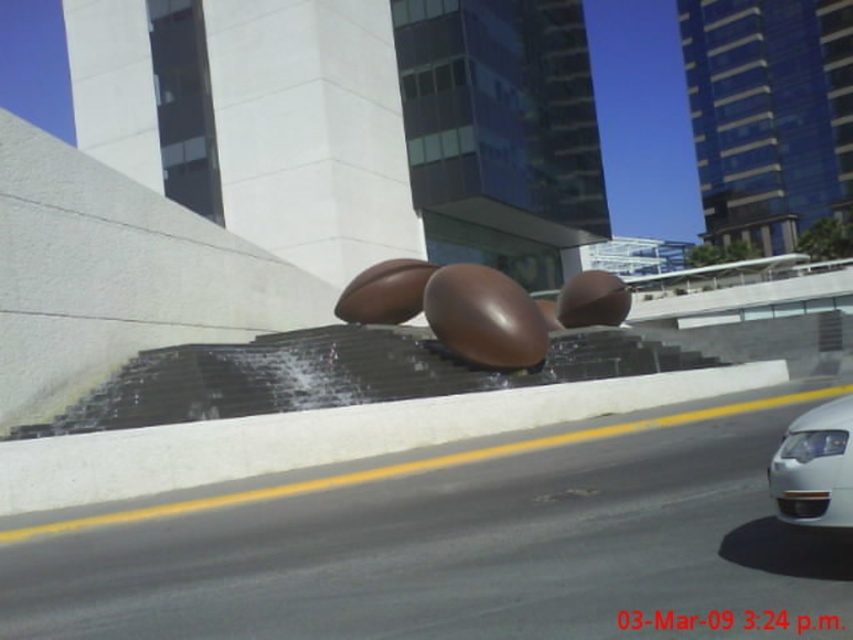
You are a photographer standing at the edge of the paved road. You want to capture a photo that includes both the shiny brown eggs at center and the white glossy car at right. Based on their sizes, which object should you focus on first to ensure both are in frame?

The shiny brown eggs at center is taller than the white glossy car at right, so you should focus on the shiny brown eggs at center first to ensure both are in frame.

You are standing in the urban scene and want to know how far the point at coordinates (462, 320) is from you. Can you determine the distance?

The point at coordinates (462, 320) is 9.48 meters away from the viewer.